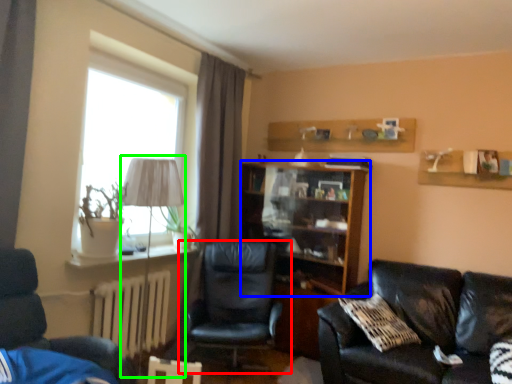
Question: Which object is positioned farthest from chair (highlighted by a red box)? Select from shelf (highlighted by a blue box) and table lamp (highlighted by a green box).

Choices:
 (A) shelf
 (B) table lamp

Answer: (B)